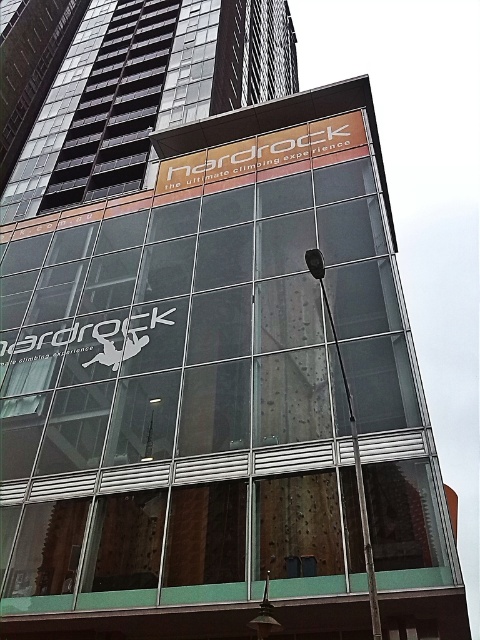
Question: Considering the relative positions of orange matte sign at upper center and black metallic pole at upper center in the image provided, where is orange matte sign at upper center located with respect to black metallic pole at upper center?

Choices:
 (A) right
 (B) left

Answer: (B)

Question: Does orange matte sign at upper center have a lesser width compared to black metallic pole at upper center?

Choices:
 (A) no
 (B) yes

Answer: (A)

Question: Which object appears closest to the camera in this image?

Choices:
 (A) orange matte sign at upper center
 (B) black metallic pole at upper center

Answer: (B)

Question: Which of the following is the farthest from the observer?

Choices:
 (A) black metallic pole at upper center
 (B) orange matte sign at upper center

Answer: (B)

Question: Considering the relative positions of orange matte sign at upper center and black metallic pole at upper center in the image provided, where is orange matte sign at upper center located with respect to black metallic pole at upper center?

Choices:
 (A) below
 (B) above

Answer: (B)